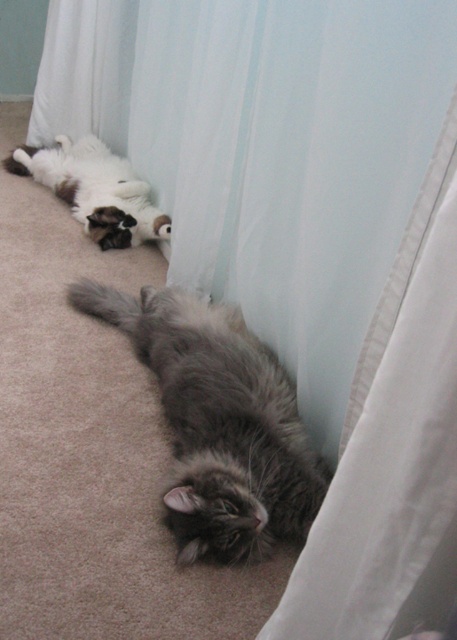
You are standing in a room with two cats. You see a gray tabby cat at center and a white cat with brown patches at the back. If you want to place a toy exactly at point (219, 422), which cat will the toy land closest to?

The toy placed at point (219, 422) will land closest to the gray tabby cat at center because the coordinates specify that location as where the gray tabby cat is situated.